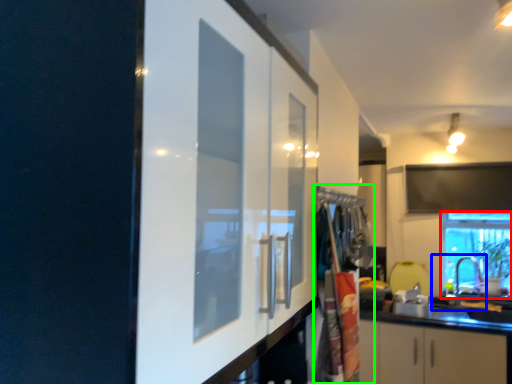
Question: Estimate the real-world distances between objects in this image. Which object is farther from window (highlighted by a red box), sink (highlighted by a blue box) or laundry (highlighted by a green box)?

Choices:
 (A) sink
 (B) laundry

Answer: (B)